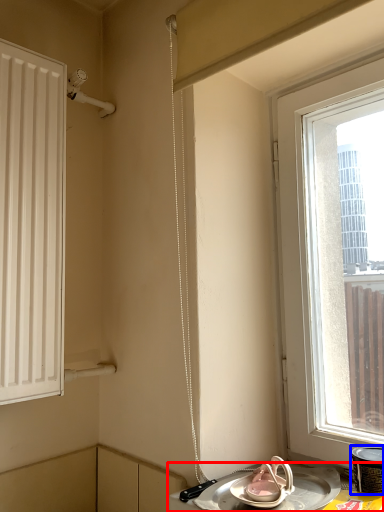
Question: Which point is further to the camera, table (highlighted by a red box) or appliance (highlighted by a blue box)?

Choices:
 (A) table
 (B) appliance

Answer: (B)